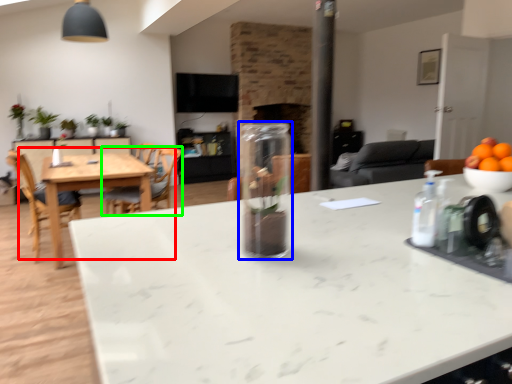
Question: Which object is the farthest from kitchen & dining room table (highlighted by a red box)? Choose among these: glass vase (highlighted by a blue box) or chair (highlighted by a green box).

Choices:
 (A) glass vase
 (B) chair

Answer: (A)